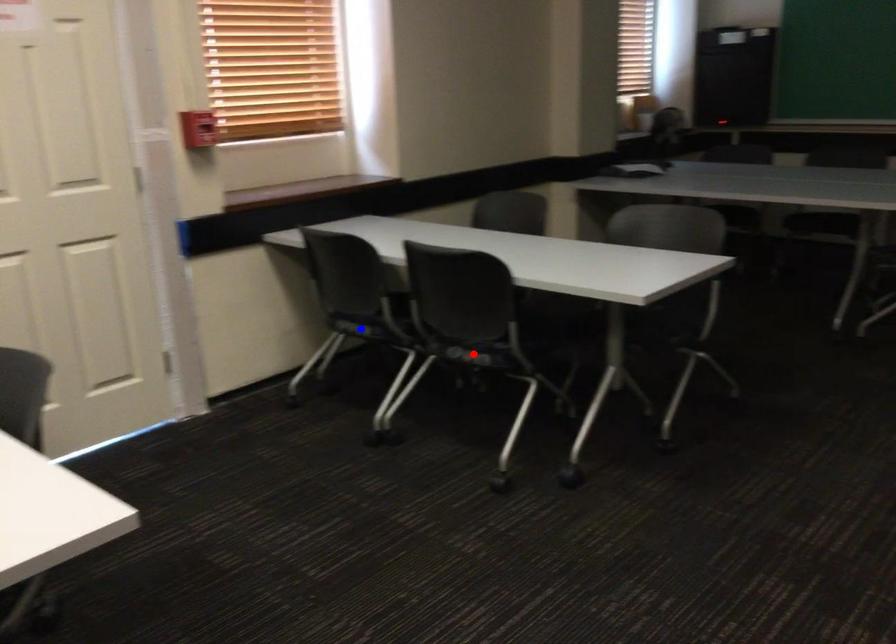
Question: In the image, two points are highlighted. Which point is nearer to the camera? Reply with the corresponding letter.

Choices:
 (A) blue point
 (B) red point

Answer: (B)